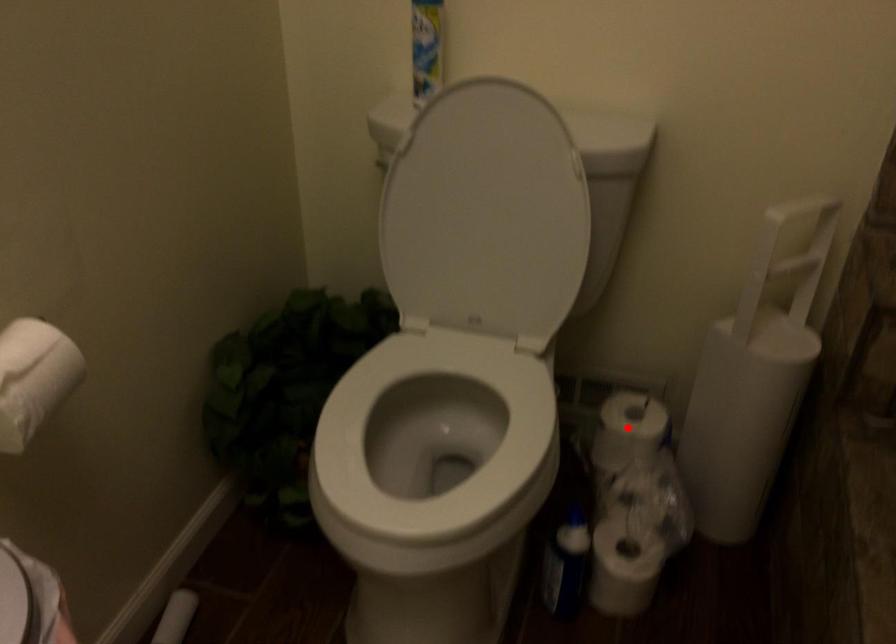
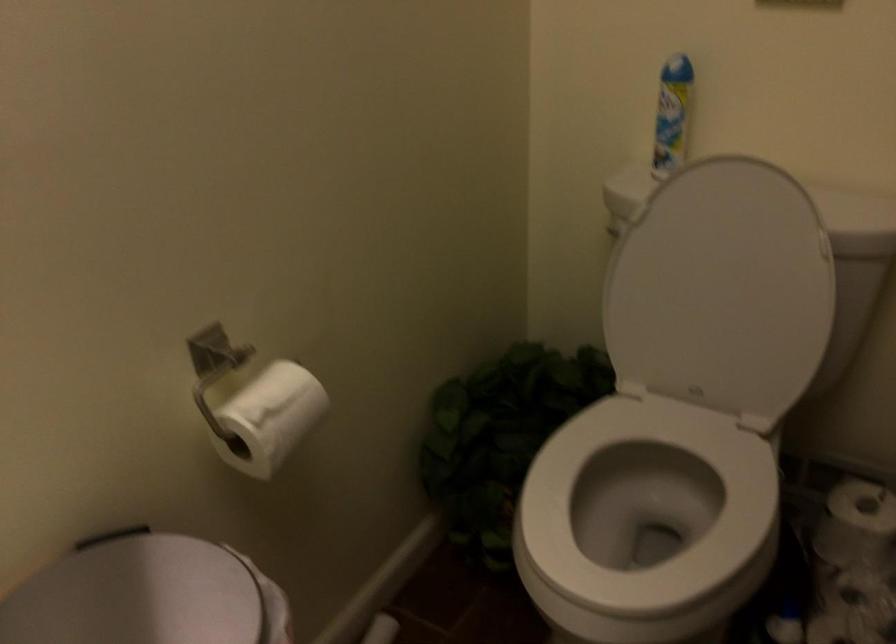
Question: I am providing you with two images of the same scene from different viewpoints. Given a red point in image1, look at the same physical point in image2. Is it:

Choices:
 (A) Closer to the viewpoint
 (B) Farther from the viewpoint

Answer: (A)